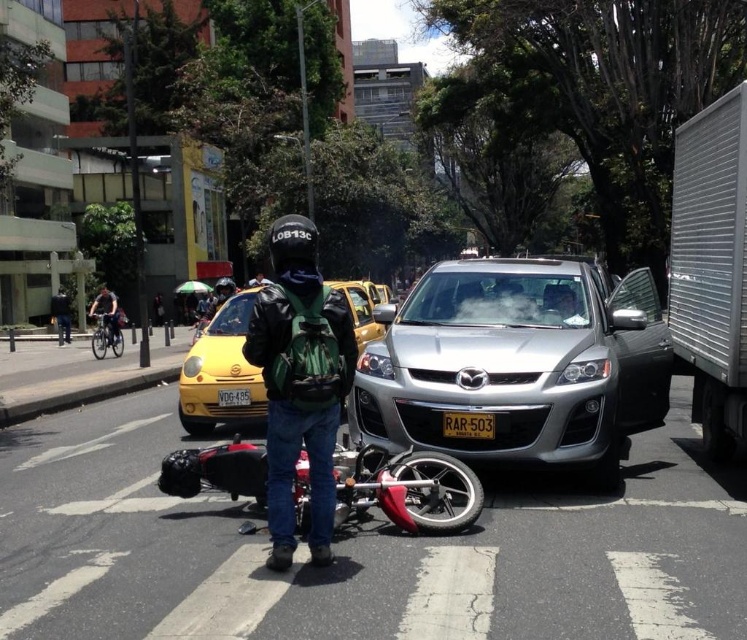
You are a delivery person who needs to place a package on top of the shiny black motorcycle at center. Considering the height of the matte black helmet at center, can you estimate if the motorcycle is tall enough to hold the package without it falling off?

The matte black helmet at center has a greater height compared to the shiny black motorcycle at center. Since the helmet is taller than the motorcycle, the motorcycle might not be tall enough to securely hold the package without it potentially sliding off.

You are a pedestrian on the road and see the matte black helmet at center and the shiny black motorcycle at center. Which object is closer to the ground?

The matte black helmet at center is closer to the ground because it is below the shiny black motorcycle at center.

You are a pedestrian trying to cross the street and see the yellow matte taxi at center and the yellow plastic license plate at center. Which one is bigger?

The yellow matte taxi at center is larger in size than the yellow plastic license plate at center.